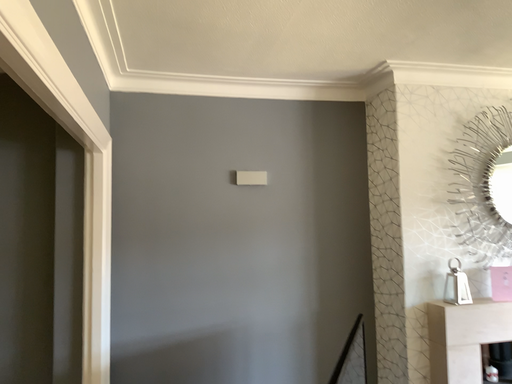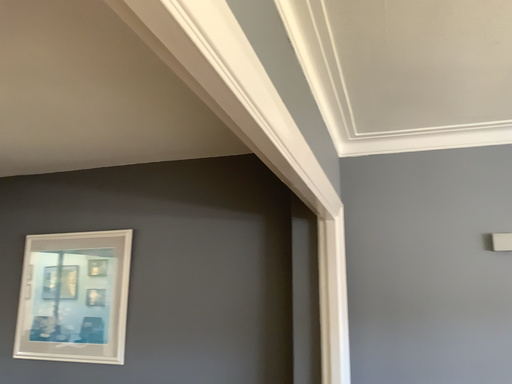
Question: Which way did the camera rotate in the video?

Choices:
 (A) rotated downward
 (B) rotated upward

Answer: (B)